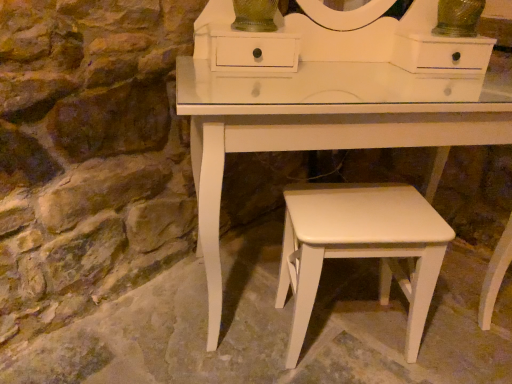
Question: Should I look upward or downward to see white matte stool at center?

Choices:
 (A) down
 (B) up

Answer: (A)